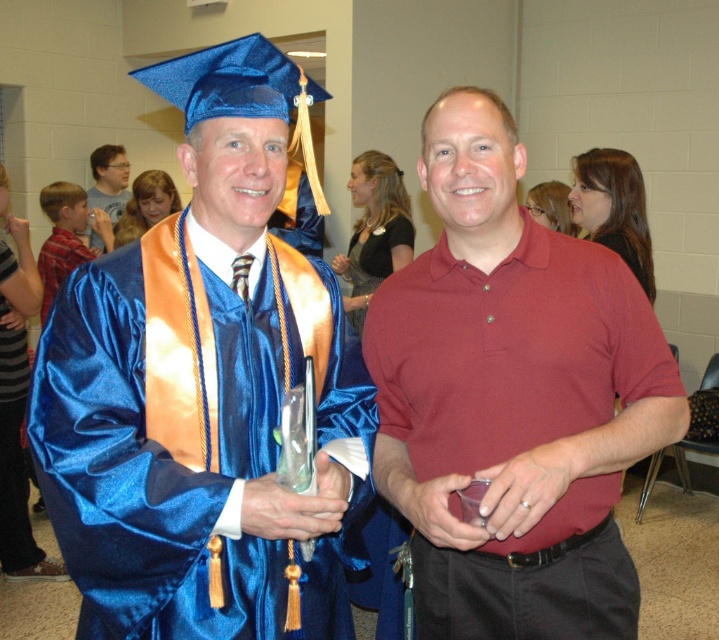
You are organizing a photo album and need to determine the relative sizes of the clothing items in the graduation photo. Which clothing item, the satin blue graduation gown at left or the matte red polo shirt at center, takes up less space in the image?

The satin blue graduation gown at left is smaller than the matte red polo shirt at center, so it takes up less space in the image.

You are a photographer at the graduation event. You need to capture a photo where both the blue satin gown at left and the matte plastic water bottle at left are visible. Based on their positions, which object should you ensure is closer to the camera to include both in the frame?

The blue satin gown at left is positioned on the right side of the matte plastic water bottle at left. To include both in the frame, ensure the matte plastic water bottle at left is closer to the camera so that the blue satin gown at left, being to its right, remains within the shot.

You are attending a graduation ceremony and notice two graduates wearing gowns. The first is the satin blue graduation gown at left, and the second is the blue satin gown at left. Which of these two gowns is positioned more to the right side of the image?

The satin blue graduation gown at left is positioned more to the right side of the image compared to the blue satin gown at left, as stated in the description.